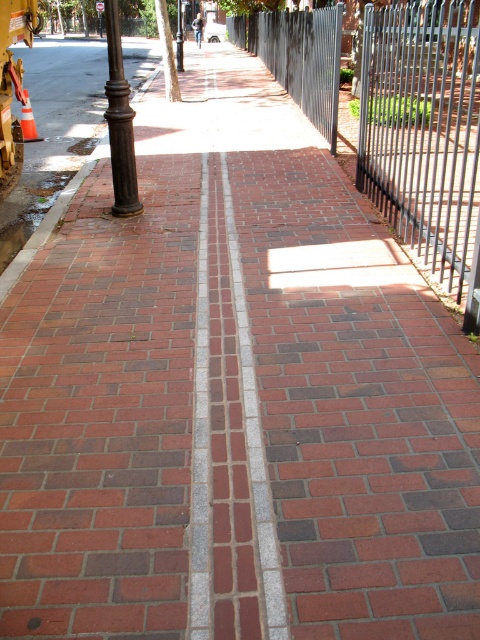
Question: Which point is closer to the camera?

Choices:
 (A) black metal fence at right
 (B) metallic street sign at upper center
 (C) black metal fence at upper right
 (D) bronze/weathered pole at left

Answer: (A)

Question: Can you confirm if black metal pole at center is positioned to the right of metallic street sign at upper center?

Choices:
 (A) yes
 (B) no

Answer: (A)

Question: Is black metal pole at center thinner than metallic street sign at upper center?

Choices:
 (A) no
 (B) yes

Answer: (A)

Question: Can you confirm if black metal fence at upper right is wider than black metal fence at right?

Choices:
 (A) no
 (B) yes

Answer: (B)

Question: Considering the real-world distances, which object is closest to the black metal fence at upper right?

Choices:
 (A) metallic street sign at upper center
 (B) black metal pole at center
 (C) black metal fence at right

Answer: (C)

Question: Estimate the real-world distances between objects in this image. Which object is farther from the black metal pole at center?

Choices:
 (A) black metal fence at right
 (B) black metal fence at upper right
 (C) metallic street sign at upper center

Answer: (C)